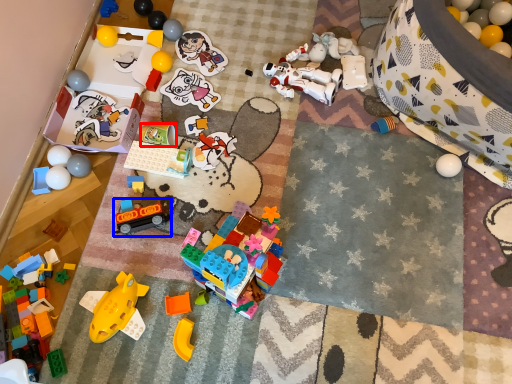
Question: Which point is further to the camera, toy (highlighted by a red box) or toy (highlighted by a blue box)?

Choices:
 (A) toy
 (B) toy

Answer: (A)